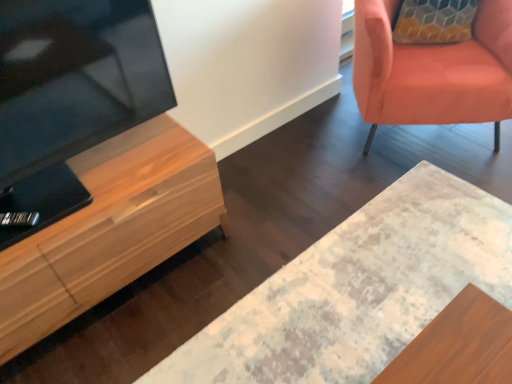
Question: From the image's perspective, is distressed wood desk at center under matte orange chair at upper right?

Choices:
 (A) yes
 (B) no

Answer: (A)

Question: Can you confirm if distressed wood desk at center is smaller than matte orange chair at upper right?

Choices:
 (A) yes
 (B) no

Answer: (A)

Question: Is distressed wood desk at center surrounding matte orange chair at upper right?

Choices:
 (A) no
 (B) yes

Answer: (A)

Question: Is distressed wood desk at center closer to camera compared to matte orange chair at upper right?

Choices:
 (A) yes
 (B) no

Answer: (A)

Question: Does distressed wood desk at center touch matte orange chair at upper right?

Choices:
 (A) no
 (B) yes

Answer: (A)

Question: Considering the positions of distressed wood desk at center and matte orange chair at upper right in the image, is distressed wood desk at center wider or thinner than matte orange chair at upper right?

Choices:
 (A) wide
 (B) thin

Answer: (A)

Question: Considering the positions of point (406, 249) and point (431, 52), is point (406, 249) closer or farther from the camera than point (431, 52)?

Choices:
 (A) farther
 (B) closer

Answer: (B)

Question: From the image's perspective, is distressed wood desk at center above or below matte orange chair at upper right?

Choices:
 (A) below
 (B) above

Answer: (A)

Question: Would you say distressed wood desk at center is inside or outside matte orange chair at upper right?

Choices:
 (A) outside
 (B) inside

Answer: (A)

Question: Is point (496, 77) positioned closer to the camera than point (24, 342)?

Choices:
 (A) farther
 (B) closer

Answer: (A)

Question: Considering their positions, is matte orange chair at upper right located in front of or behind light wood cabinet at left?

Choices:
 (A) behind
 (B) front

Answer: (A)

Question: Looking at their shapes, would you say matte orange chair at upper right is wider or thinner than light wood cabinet at left?

Choices:
 (A) thin
 (B) wide

Answer: (B)

Question: From a real-world perspective, relative to light wood cabinet at left, is matte orange chair at upper right vertically above or below?

Choices:
 (A) below
 (B) above

Answer: (B)

Question: Considering the positions of point (31, 279) and point (373, 52), is point (31, 279) closer or farther from the camera than point (373, 52)?

Choices:
 (A) closer
 (B) farther

Answer: (A)

Question: From the image's perspective, is light wood cabinet at left located above or below matte orange chair at upper right?

Choices:
 (A) below
 (B) above

Answer: (A)